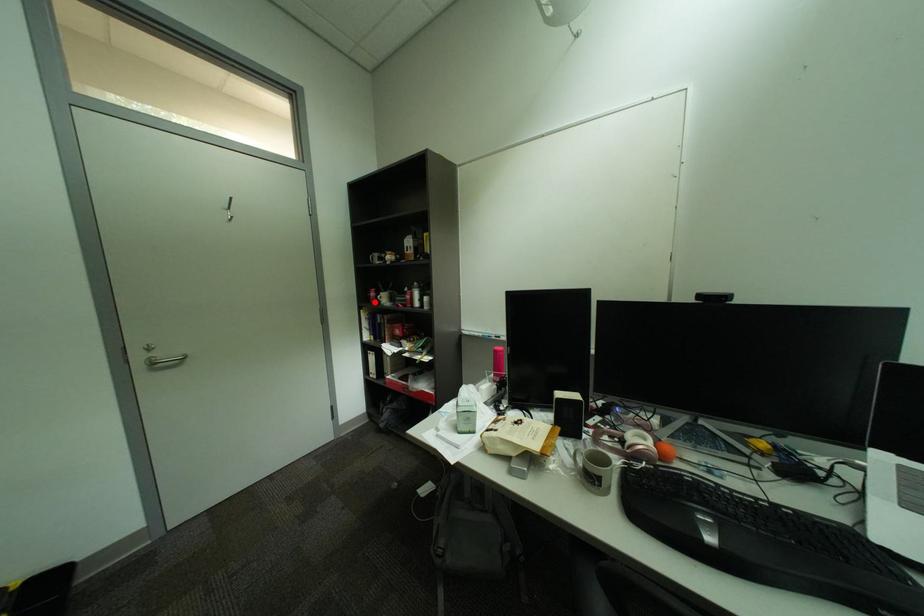
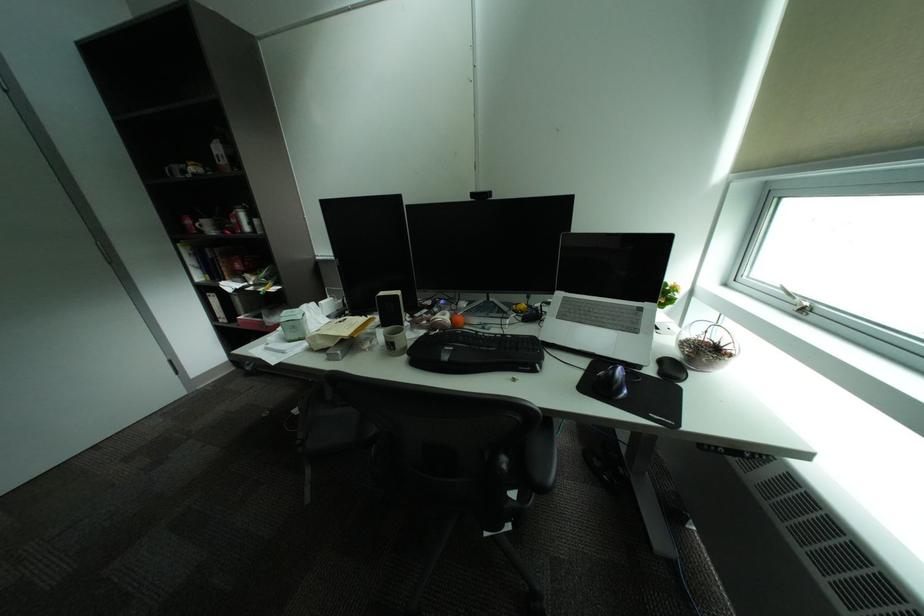
The point at the highlighted location is marked in the first image. Where is the corresponding point in the second image?

(189, 233)